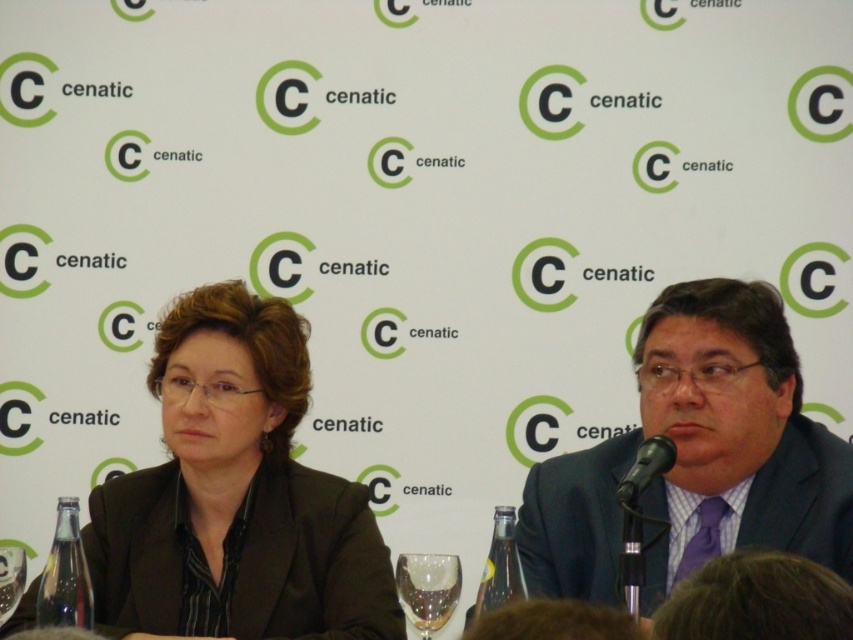
Which is behind, point (213, 467) or point (450, 579)?

The point (213, 467) is behind.

Can you confirm if matte black blazer at center is positioned above transparent glass at center?

Indeed, matte black blazer at center is positioned over transparent glass at center.

Who is more forward, (244, 346) or (437, 572)?

Positioned in front is point (437, 572).

At what (x,y) coordinates should I click in order to perform the action: click on matte black blazer at center. Please return your answer as a coordinate pair (x, y). This screenshot has height=640, width=853. Looking at the image, I should click on (235, 497).

Does matte black blazer at center have a greater width compared to matte black suit at center?

Yes, matte black blazer at center is wider than matte black suit at center.

Consider the image. Does matte black blazer at center appear under matte black suit at center?

Yes, matte black blazer at center is below matte black suit at center.

The width and height of the screenshot is (853, 640). Find the location of `matte black blazer at center`. matte black blazer at center is located at coordinates (235, 497).

Who is positioned more to the left, matte black suit at center or transparent glass at center?

transparent glass at center

Between matte black suit at center and transparent glass at center, which one is positioned higher?

matte black suit at center is above.

Does point (662, 403) come in front of point (434, 584)?

No.

Locate an element on the screen. matte black suit at center is located at coordinates (697, 456).